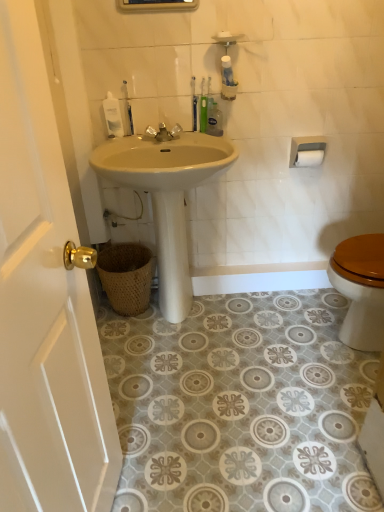
Question: Is white matte soap at upper center next to white plastic toilet paper holder at upper right?

Choices:
 (A) yes
 (B) no

Answer: (B)

Question: Can you confirm if white matte soap at upper center is shorter than white plastic toilet paper holder at upper right?

Choices:
 (A) yes
 (B) no

Answer: (A)

Question: Is white matte soap at upper center aimed at white plastic toilet paper holder at upper right?

Choices:
 (A) yes
 (B) no

Answer: (B)

Question: Is the depth of white matte soap at upper center less than that of white plastic toilet paper holder at upper right?

Choices:
 (A) yes
 (B) no

Answer: (A)

Question: From a real-world perspective, is white matte soap at upper center positioned over white plastic toilet paper holder at upper right based on gravity?

Choices:
 (A) no
 (B) yes

Answer: (B)

Question: Is translucent plastic bottle at upper center, the third toiletry when ordered from left to right, spatially inside white matte soap at upper center, or outside of it?

Choices:
 (A) inside
 (B) outside

Answer: (B)

Question: From the image's perspective, is translucent plastic bottle at upper center, which is the first toiletry from right to left, located above or below white matte soap at upper center?

Choices:
 (A) below
 (B) above

Answer: (A)

Question: From a real-world perspective, is translucent plastic bottle at upper center, the third toiletry when ordered from left to right, positioned above or below white matte soap at upper center?

Choices:
 (A) below
 (B) above

Answer: (A)

Question: Considering their positions, is translucent plastic bottle at upper center, which is the first toiletry from right to left, located in front of or behind white matte soap at upper center?

Choices:
 (A) behind
 (B) front

Answer: (A)

Question: From the image's perspective, relative to metallic faucet at center, is white glossy door at left above or below?

Choices:
 (A) below
 (B) above

Answer: (A)

Question: In terms of size, does white glossy door at left appear bigger or smaller than metallic faucet at center?

Choices:
 (A) big
 (B) small

Answer: (A)

Question: From a real-world perspective, relative to metallic faucet at center, is white glossy door at left vertically above or below?

Choices:
 (A) below
 (B) above

Answer: (A)

Question: Considering the positions of white glossy door at left and metallic faucet at center in the image, is white glossy door at left wider or thinner than metallic faucet at center?

Choices:
 (A) wide
 (B) thin

Answer: (A)

Question: In terms of width, does white matte toilet paper at upper right look wider or thinner when compared to white plastic soap dispenser at upper left, the first toiletry in the left-to-right sequence?

Choices:
 (A) wide
 (B) thin

Answer: (A)

Question: Would you say white matte toilet paper at upper right is to the left or to the right of white plastic soap dispenser at upper left, the first toiletry in the left-to-right sequence, in the picture?

Choices:
 (A) right
 (B) left

Answer: (A)